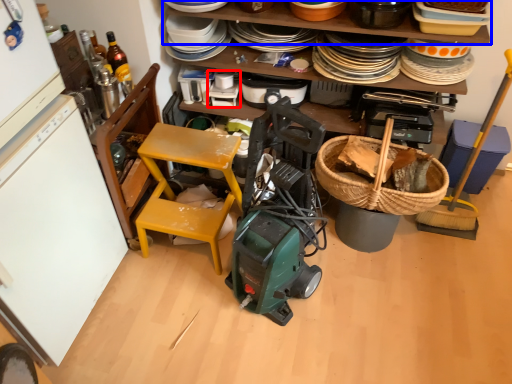
Question: Which object is further to the camera taking this photo, appliance (highlighted by a red box) or shelf (highlighted by a blue box)?

Choices:
 (A) appliance
 (B) shelf

Answer: (A)